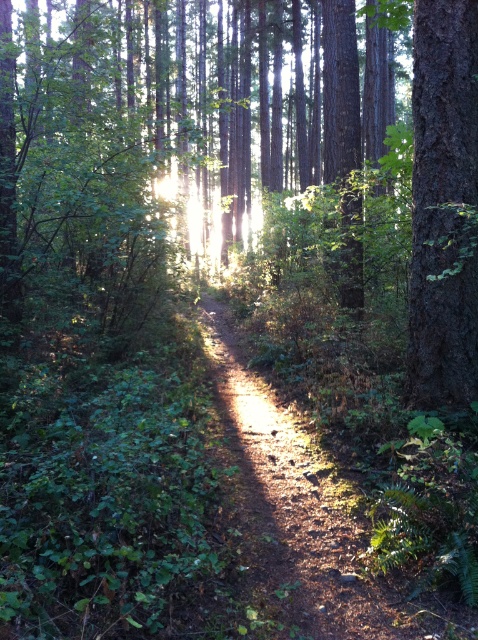
You are a hiker carrying a backpack and want to walk along the dirt path at center. There is a smooth bark tree at right nearby. Can you walk between them without stepping off the path?

The dirt path at center might be wider than smooth bark tree at right, so there is a possibility that you can walk between them without stepping off the path. However, the exact width is uncertain based on the given information.

You are a hiker walking along the narrow dirt path in the center of the forest. You notice two trees ahead of you. One is a brown textured tree at center, and the other is a smooth bark tree at right. Which tree would you encounter first as you continue walking along the path?

The brown textured tree at center would be encountered first because it is positioned over the smooth bark tree at right, indicating it is closer to the path.

You are standing at the point marked by the coordinates point (245,138) in the forest scene. What object is located exactly at that point?

The point (245,138) marks the location of a brown textured tree at center.